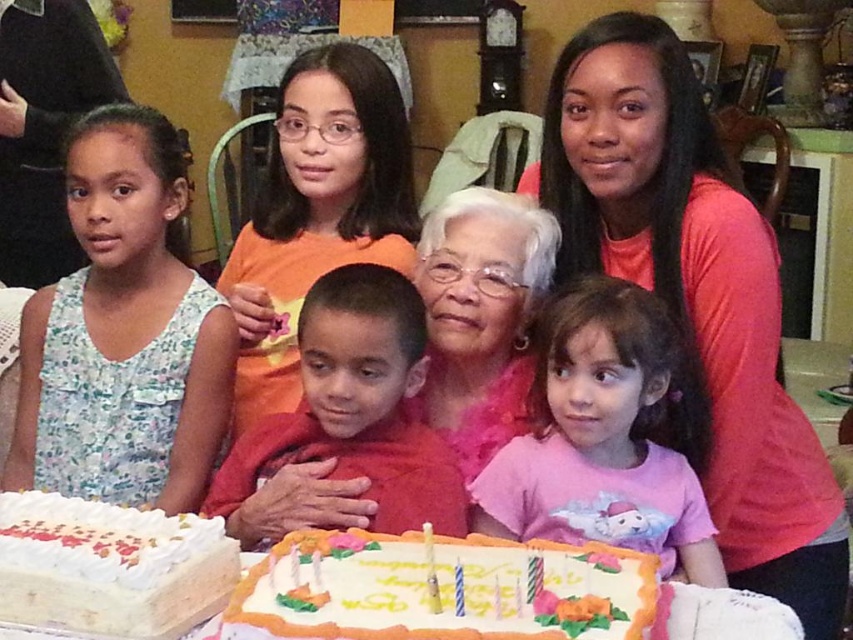
You are a photographer at the birthday party. You need to take a photo of the pink satin blouse at center and the white frosted cake at lower left. Which object is positioned to the right of the other?

The pink satin blouse at center is to the right of the white frosted cake at lower left.